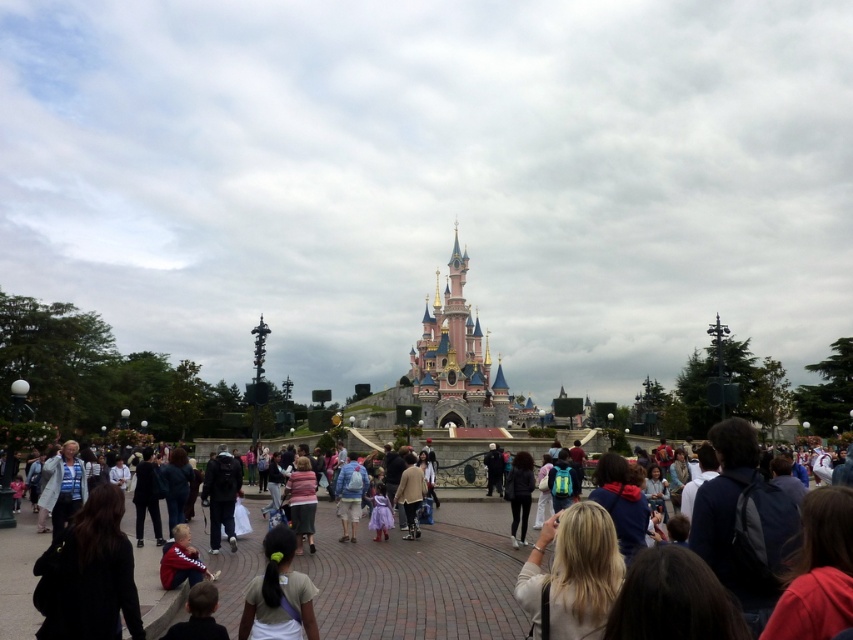
You are a photographer standing in the theme park and want to take a photo of the black fabric at center and the dark blue jeans at center. Which object should you focus on first to ensure both are in focus?

The black fabric at center is in front of dark blue jeans at center, so you should focus on the black fabric at center first to ensure both are in focus.

You are a photographer trying to capture a clear shot of the iconic Disneyland Paris castle in the background. You notice two subjects in the foreground, a person with light brown hair at center and a person wearing a light brown leather jacket at center. Which subject might block your view of the castle more due to their width?

The light brown hair at center might block the view more than the light brown leather jacket at center since it is wider according to the description.

You are a photographer at the theme park and want to capture both the light brown hair at center and the light brown leather jacket at center in a single frame. Which object should you focus on first to ensure both are in the frame?

You should focus on the light brown hair at center first since it has a larger size compared to the light brown leather jacket at center, ensuring it fits within the frame while adjusting for the smaller jacket.